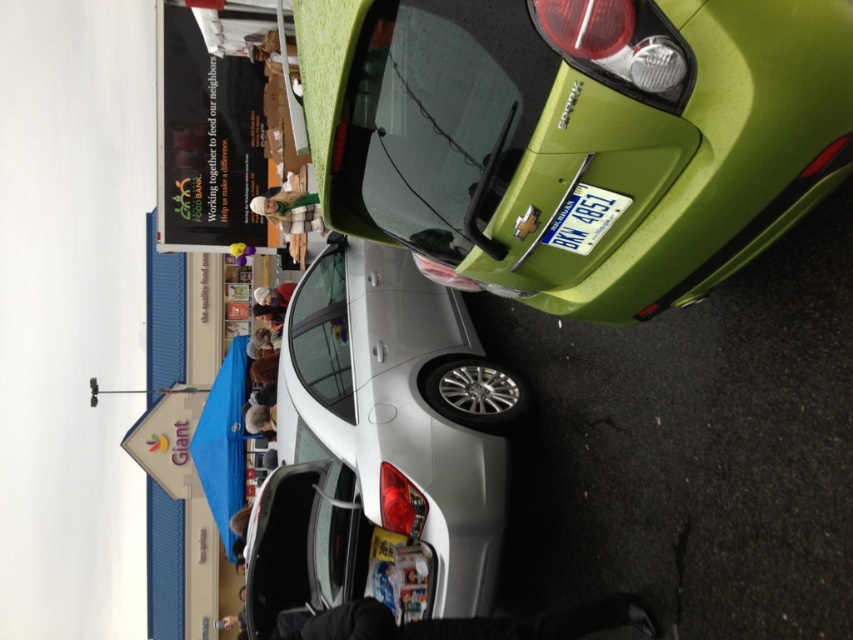
Can you confirm if satin silver sedan at center is thinner than blue metallic license plate at center?

In fact, satin silver sedan at center might be wider than blue metallic license plate at center.

Measure the distance between satin silver sedan at center and camera.

satin silver sedan at center and camera are 6.63 meters apart.

This screenshot has height=640, width=853. I want to click on satin silver sedan at center, so click(398, 419).

I want to click on satin silver sedan at center, so click(x=398, y=419).

Based on the photo, is green matte car at upper right wider than satin silver sedan at center?

Yes, green matte car at upper right is wider than satin silver sedan at center.

Does green matte car at upper right have a greater height compared to satin silver sedan at center?

Incorrect, green matte car at upper right's height is not larger of satin silver sedan at center's.

Is point (651, 176) positioned behind point (422, 486)?

No, (651, 176) is in front of (422, 486).

Identify the location of green matte car at upper right. (576, 134).

Who is more distant from viewer, (376, 124) or (601, 218)?

Positioned behind is point (376, 124).

You are a GUI agent. You are given a task and a screenshot of the screen. Output one action in this format:
    pyautogui.click(x=<x>, y=<y>)
    Task: Click on the green matte car at upper right
    The image size is (853, 640).
    Given the screenshot: What is the action you would take?
    click(576, 134)

Is point (573, 257) farther from viewer compared to point (560, 225)?

Yes.

Locate an element on the screen. This screenshot has width=853, height=640. green matte car at upper right is located at coordinates (576, 134).